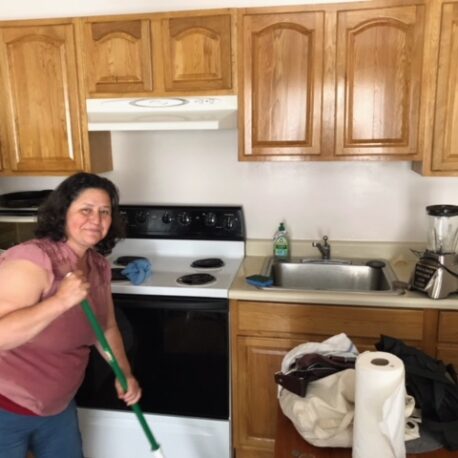
The image size is (458, 458). I want to click on coil heating elements on stove top, so click(193, 277), click(208, 263), click(124, 258), click(116, 271).